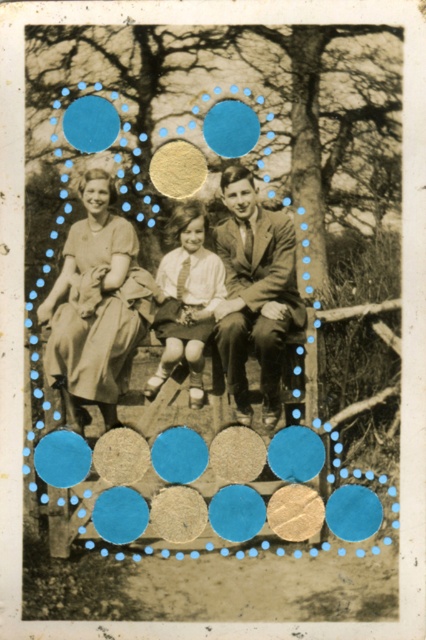
Question: Does smooth brown suit at center appear under matte yellow circle at center?

Choices:
 (A) no
 (B) yes

Answer: (B)

Question: Estimate the real-world distances between objects in this image. Which object is farther from the blue paper circle at upper left?

Choices:
 (A) light beige dress at left
 (B) blue matte circle at center
 (C) matte yellow circle at center

Answer: (A)

Question: Which is nearer to the blue matte circle at center?

Choices:
 (A) blue paper circle at upper left
 (B) light beige dress at left
 (C) matte brown suit at center
 (D) matte yellow circle at center

Answer: (D)

Question: Does matte white shirt at center have a greater width compared to matte yellow circle at center?

Choices:
 (A) no
 (B) yes

Answer: (B)

Question: Which of the following is the closest to the observer?

Choices:
 (A) (155, 384)
 (B) (244, 352)
 (C) (155, 177)
 (D) (221, 148)

Answer: (A)

Question: Can you confirm if matte white shirt at center is positioned to the right of blue paper circle at upper left?

Choices:
 (A) no
 (B) yes

Answer: (B)